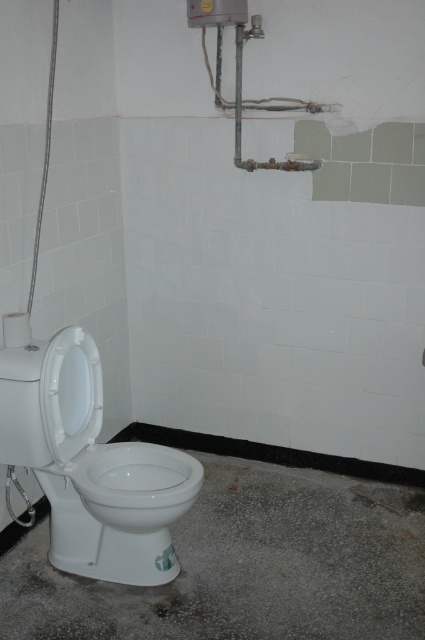
Does gray concrete floor at lower center have a larger size compared to metallic gray pipes at upper center?

Yes, gray concrete floor at lower center is bigger than metallic gray pipes at upper center.

From the picture: Which is above, gray concrete floor at lower center or metallic gray pipes at upper center?

metallic gray pipes at upper center

Where is `gray concrete floor at lower center`? This screenshot has width=425, height=640. gray concrete floor at lower center is located at coordinates (248, 563).

Which is more to the left, gray concrete floor at lower center or white glossy toilet bowl at center?

Positioned to the left is white glossy toilet bowl at center.

Describe the element at coordinates (248, 563) in the screenshot. I see `gray concrete floor at lower center` at that location.

The height and width of the screenshot is (640, 425). I want to click on gray concrete floor at lower center, so click(248, 563).

Can you confirm if white glossy toilet bowl at center is positioned to the right of metallic gray pipes at upper center?

In fact, white glossy toilet bowl at center is to the left of metallic gray pipes at upper center.

Can you confirm if white glossy toilet bowl at center is positioned below metallic gray pipes at upper center?

Yes, white glossy toilet bowl at center is below metallic gray pipes at upper center.

Between point (170, 448) and point (238, 93), which one is positioned behind?

The point (238, 93) is more distant.

Where is `white glossy toilet bowl at center`? Image resolution: width=425 pixels, height=640 pixels. white glossy toilet bowl at center is located at coordinates (136, 483).